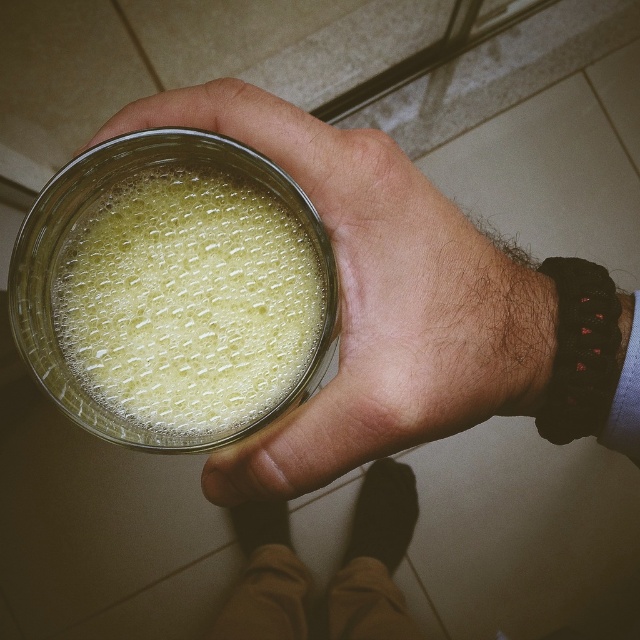
Question: Does clear glass jar at center have a lesser width compared to translucent glass jar at center?

Choices:
 (A) no
 (B) yes

Answer: (A)

Question: Among these objects, which one is farthest from the camera?

Choices:
 (A) clear glass jar at center
 (B) translucent glass jar at center

Answer: (B)

Question: Which point is farther to the camera?

Choices:
 (A) (388, 392)
 (B) (90, 368)

Answer: (B)

Question: Is clear glass jar at center closer to the viewer compared to translucent glass jar at center?

Choices:
 (A) yes
 (B) no

Answer: (A)

Question: Is clear glass jar at center closer to the viewer compared to translucent glass jar at center?

Choices:
 (A) no
 (B) yes

Answer: (B)